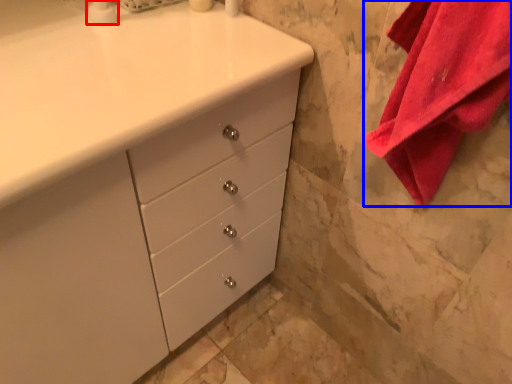
Question: Among these objects, which one is nearest to the camera, soap dispenser (highlighted by a red box) or bath towel (highlighted by a blue box)?

Choices:
 (A) soap dispenser
 (B) bath towel

Answer: (B)